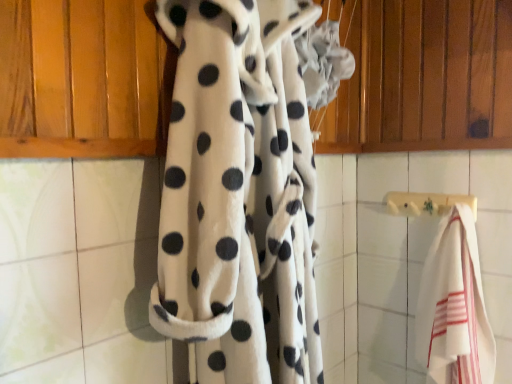
Question: Is point (238, 210) positioned closer to the camera than point (475, 206)?

Choices:
 (A) farther
 (B) closer

Answer: (B)

Question: From a real-world perspective, is white fleece blanket at center positioned above or below wooden towel bar at center?

Choices:
 (A) above
 (B) below

Answer: (A)

Question: Estimate the real-world distances between objects in this image. Which object is closer to the wooden towel bar at center?

Choices:
 (A) white fleece blanket at center
 (B) white striped towel at right

Answer: (B)

Question: Which object is positioned farthest from the white fleece blanket at center?

Choices:
 (A) wooden towel bar at center
 (B) white striped towel at right

Answer: (A)